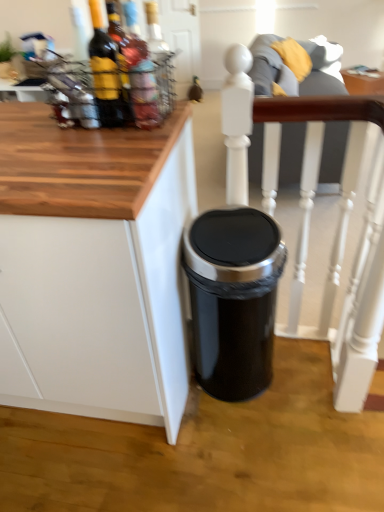
Question: From a real-world perspective, is matte glass bottle at upper left, which is the 2th bottle in right-to-left order, positioned above or below white painted wood chair at center?

Choices:
 (A) below
 (B) above

Answer: (B)

Question: Would you say matte glass bottle at upper left, which is the 2th bottle in right-to-left order, is inside or outside white painted wood chair at center?

Choices:
 (A) outside
 (B) inside

Answer: (A)

Question: Which object is positioned closest to the translucent glass bottle at upper left, which ranks as the 1th bottle in right-to-left order?

Choices:
 (A) matte glass bottle at upper left, which is the 2th bottle in right-to-left order
 (B) black metallic trash can at center
 (C) matte glass bottle at upper left, positioned as the 3th bottle in right-to-left order
 (D) white matte cabinet at lower right
 (E) white painted wood chair at center

Answer: (A)

Question: Estimate the real-world distances between objects in this image. Which object is farther from the black metallic trash can at center?

Choices:
 (A) matte glass bottle at upper left, which is the 2th bottle in right-to-left order
 (B) white painted wood chair at center
 (C) matte glass bottle at upper left, positioned as the 3th bottle in right-to-left order
 (D) translucent glass bottle at upper left, which ranks as the 1th bottle in right-to-left order
 (E) white matte cabinet at lower right

Answer: (D)